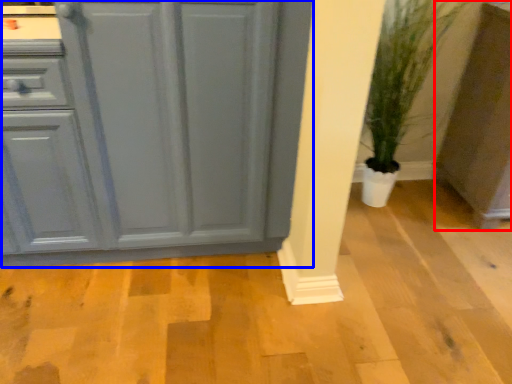
Question: Which object appears farthest to the camera in this image, cabinetry (highlighted by a red box) or cabinetry (highlighted by a blue box)?

Choices:
 (A) cabinetry
 (B) cabinetry

Answer: (A)